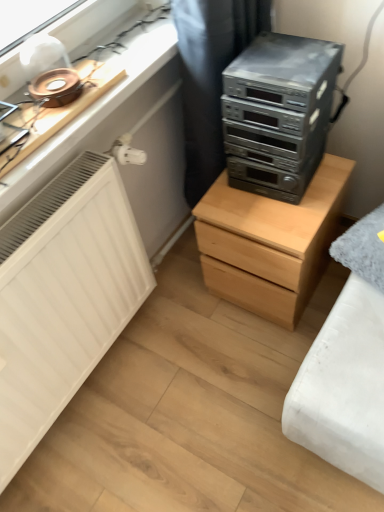
Locate an element on the screen. vacant space in front of light wood chest of drawers at center is located at coordinates (254, 364).